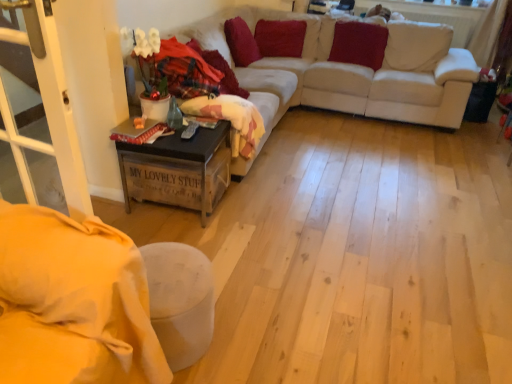
Question: Is fluffy pink blanket at center thinner than velvet red pillow at upper center, the 2th pillow positioned from the left?

Choices:
 (A) yes
 (B) no

Answer: (B)

Question: From the image's perspective, would you say fluffy pink blanket at center is shown under velvet red pillow at upper center, the 2th pillow positioned from the left?

Choices:
 (A) yes
 (B) no

Answer: (A)

Question: Considering the relative positions of fluffy pink blanket at center and velvet red pillow at upper center, the 2th pillow positioned from the left, in the image provided, is fluffy pink blanket at center to the left of velvet red pillow at upper center, the 2th pillow positioned from the left, from the viewer's perspective?

Choices:
 (A) no
 (B) yes

Answer: (B)

Question: Can you confirm if fluffy pink blanket at center is bigger than velvet red pillow at upper center, the 2th pillow positioned from the left?

Choices:
 (A) no
 (B) yes

Answer: (B)

Question: Can you confirm if fluffy pink blanket at center is taller than velvet red pillow at upper center, which ranks as the second pillow in right-to-left order?

Choices:
 (A) no
 (B) yes

Answer: (A)

Question: Could velvet red pillow at upper center, which ranks as the second pillow in right-to-left order, be considered to be inside fluffy pink blanket at center?

Choices:
 (A) no
 (B) yes

Answer: (A)

Question: Can you confirm if fluffy pink blanket at center is shorter than velvet red pillow at upper center, which appears as the 3th pillow when viewed from the right?

Choices:
 (A) yes
 (B) no

Answer: (A)

Question: Is the surface of fluffy pink blanket at center in direct contact with velvet red pillow at upper center, which appears as the 3th pillow when viewed from the right?

Choices:
 (A) yes
 (B) no

Answer: (B)

Question: Does fluffy pink blanket at center lie behind velvet red pillow at upper center, which is the 1th pillow in left-to-right order?

Choices:
 (A) no
 (B) yes

Answer: (A)

Question: From the image's perspective, would you say fluffy pink blanket at center is shown under velvet red pillow at upper center, which is the 1th pillow in left-to-right order?

Choices:
 (A) no
 (B) yes

Answer: (B)

Question: Is fluffy pink blanket at center smaller than velvet red pillow at upper center, which appears as the 3th pillow when viewed from the right?

Choices:
 (A) yes
 (B) no

Answer: (B)

Question: Can you confirm if fluffy pink blanket at center is bigger than velvet red pillow at upper center, which is the 1th pillow in left-to-right order?

Choices:
 (A) no
 (B) yes

Answer: (B)

Question: Can you confirm if wooden crate at lower left is smaller than velvet red pillow at upper right, the 1th pillow positioned from the right?

Choices:
 (A) no
 (B) yes

Answer: (A)